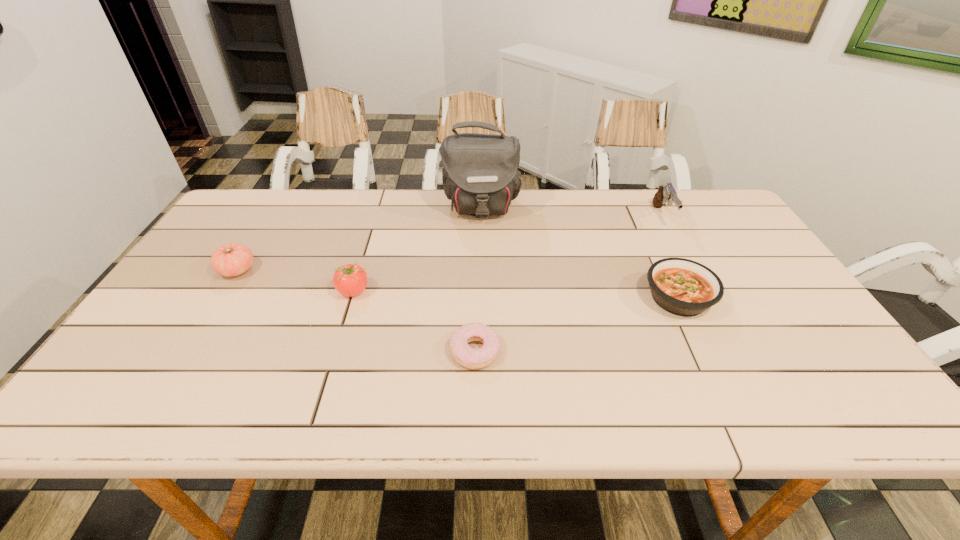
Where is `the tallest object`? The image size is (960, 540). the tallest object is located at coordinates (480, 176).

Find the location of `pistol`. pistol is located at coordinates (667, 193).

This screenshot has width=960, height=540. Find the location of `the right tomato`. the right tomato is located at coordinates (350, 280).

You are a GUI agent. You are given a task and a screenshot of the screen. Output one action in this format:
    pyautogui.click(x=<x>, y=<y>)
    Task: Click on the leftmost object
    The height and width of the screenshot is (540, 960).
    Given the screenshot: What is the action you would take?
    pyautogui.click(x=233, y=259)

This screenshot has height=540, width=960. Find the location of `stew`. stew is located at coordinates (683, 287).

You are a GUI agent. You are given a task and a screenshot of the screen. Output one action in this format:
    pyautogui.click(x=<x>, y=<y>)
    Task: Click on the shortest object
    
    Given the screenshot: What is the action you would take?
    pyautogui.click(x=463, y=354)

The image size is (960, 540). In order to click on the nearest object in this screenshot , I will do (x=463, y=354).

What are the coordinates of `free spot located on the open flap of the tallest object` in the screenshot? It's located at (481, 257).

Locate an element on the screen. vacant area situated 0.070m at the barrel of the pistol is located at coordinates click(x=679, y=248).

Where is `free space located 0.150m on the left of the right tomato`? This screenshot has width=960, height=540. free space located 0.150m on the left of the right tomato is located at coordinates (278, 291).